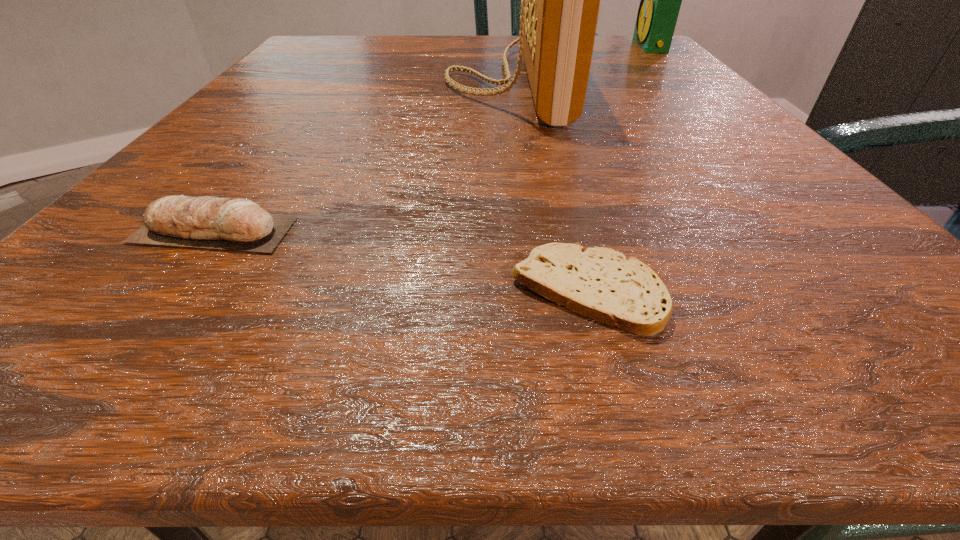
I want to click on free space between the shortest object and the left pita bread, so click(x=400, y=261).

Where is `vacant space that is in between the second shortest object and the shortest object`? The height and width of the screenshot is (540, 960). vacant space that is in between the second shortest object and the shortest object is located at coordinates (400, 261).

Where is `free space that is in between the leftmost object and the rightmost object`? The width and height of the screenshot is (960, 540). free space that is in between the leftmost object and the rightmost object is located at coordinates (432, 138).

The height and width of the screenshot is (540, 960). Find the location of `vacant area that lies between the handbag and the shorter pita bread`. vacant area that lies between the handbag and the shorter pita bread is located at coordinates (550, 186).

The width and height of the screenshot is (960, 540). I want to click on free space between the taller pita bread and the second tallest object, so click(432, 138).

Where is `free spot between the shortest object and the left pita bread`? Image resolution: width=960 pixels, height=540 pixels. free spot between the shortest object and the left pita bread is located at coordinates (400, 261).

Find the location of a particular element. Image resolution: width=960 pixels, height=540 pixels. empty space that is in between the tallest object and the right pita bread is located at coordinates (550, 186).

Where is `object that stands as the closest to the right pita bread`? object that stands as the closest to the right pita bread is located at coordinates (239, 224).

Identify which object is located as the third nearest to the rightmost object. Please provide its 2D coordinates. Your answer should be formatted as a tuple, i.e. [(x, y)], where the tuple contains the x and y coordinates of a point satisfying the conditions above.

[(239, 224)]

Find the location of a particular element. This screenshot has width=960, height=540. blank space that satisfies the following two spatial constraints: 1. on the decorative side of the tallest object; 2. on the left side of the shortest object is located at coordinates (547, 291).